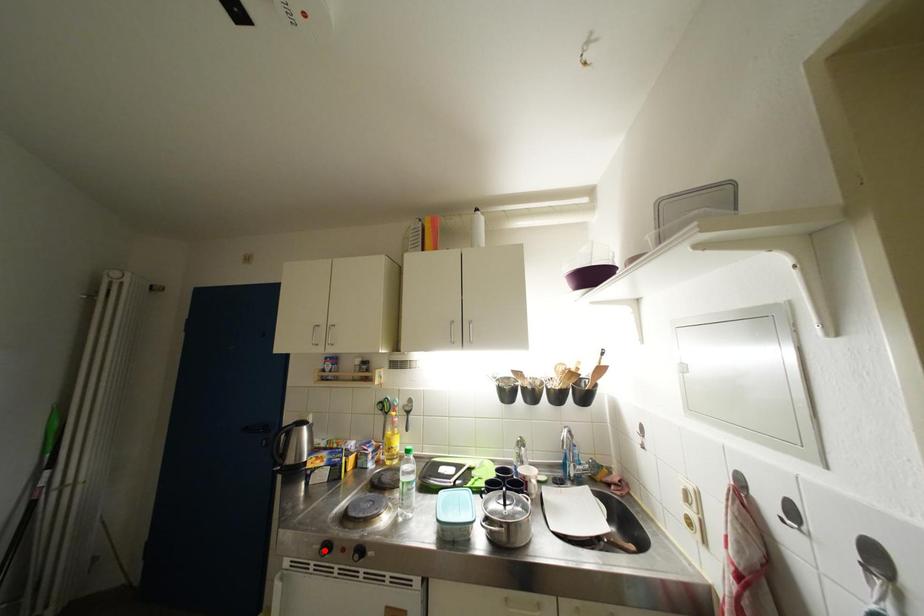
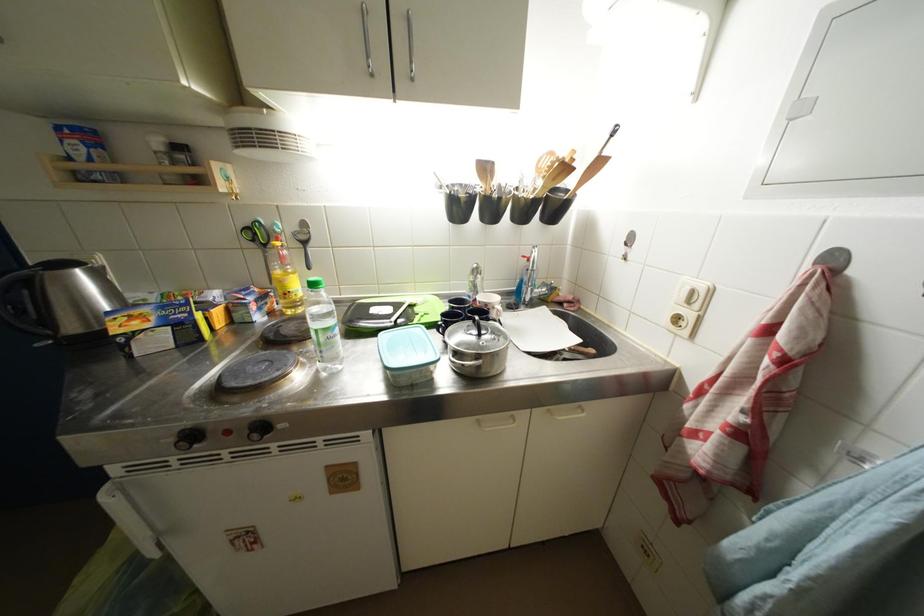
In the second image, find the point that corresponds to the highlighted location in the first image.

(178, 444)